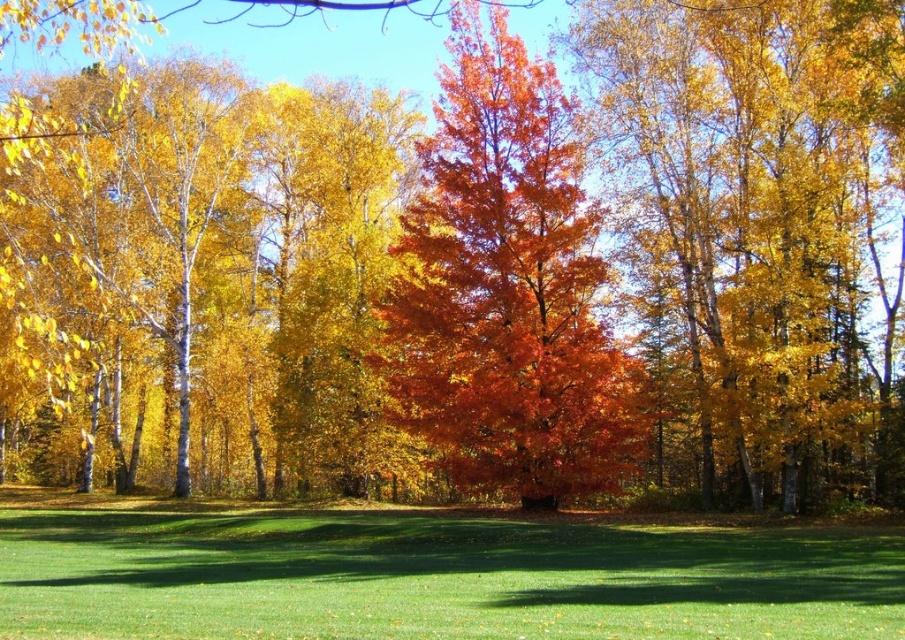
How distant is green grass at center from shiny orange leaves at center?

Result: The distance of green grass at center from shiny orange leaves at center is 10.47 meters.

Is green grass at center to the left of shiny orange leaves at center from the viewer's perspective?

Yes, green grass at center is to the left of shiny orange leaves at center.

Locate an element on the screen. The height and width of the screenshot is (640, 905). green grass at center is located at coordinates (436, 577).